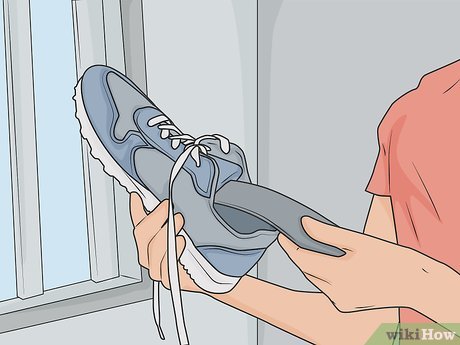
Locate an element on the screen. Image resolution: width=460 pixels, height=345 pixels. lace is located at coordinates (175, 311).